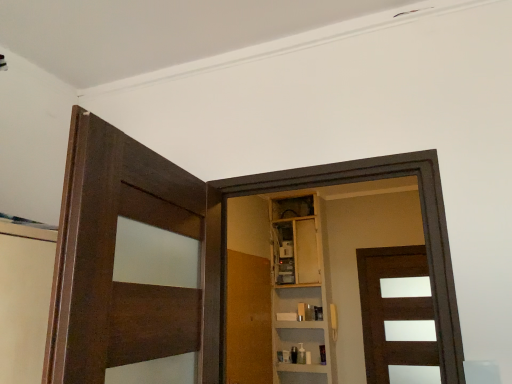
Question: Can you confirm if dark wood door at left, placed as the third door when sorted from right to left, is smaller than wooden door at center, the 2th door when ordered from front to back?

Choices:
 (A) yes
 (B) no

Answer: (A)

Question: Is dark wood door at left, placed as the third door when sorted from right to left, positioned far away from wooden door at center, the 2th door when ordered from front to back?

Choices:
 (A) no
 (B) yes

Answer: (B)

Question: From a real-world perspective, is dark wood door at left, the first door viewed from the left, positioned over wooden door at center, the 2th door when ordered from front to back, based on gravity?

Choices:
 (A) yes
 (B) no

Answer: (A)

Question: Can you confirm if dark wood door at left, which is the 3th door from back to front, is bigger than wooden door at center, which appears as the second door when viewed from the back?

Choices:
 (A) yes
 (B) no

Answer: (B)

Question: Is dark wood door at left, placed as the third door when sorted from right to left, facing away from wooden door at center, the 2th door when ordered from front to back?

Choices:
 (A) no
 (B) yes

Answer: (A)

Question: Is dark wood door at left, the first door viewed from the left, closer to the viewer compared to wooden door at center, marked as the 2th door in a left-to-right arrangement?

Choices:
 (A) yes
 (B) no

Answer: (A)

Question: Is wooden cabinet at center facing towards dark wood door at left, which is the 3th door from back to front?

Choices:
 (A) no
 (B) yes

Answer: (B)

Question: Is wooden cabinet at center further to camera compared to dark wood door at left, the first door viewed from the left?

Choices:
 (A) no
 (B) yes

Answer: (B)

Question: Is wooden cabinet at center outside dark wood door at left, placed as the third door when sorted from right to left?

Choices:
 (A) no
 (B) yes

Answer: (B)

Question: From a real-world perspective, does wooden cabinet at center stand above dark wood door at left, placed as the third door when sorted from right to left?

Choices:
 (A) yes
 (B) no

Answer: (A)

Question: Can you confirm if wooden cabinet at center is taller than dark wood door at left, placed as the third door when sorted from right to left?

Choices:
 (A) yes
 (B) no

Answer: (A)

Question: Is wooden cabinet at center positioned in front of dark wood door at left, placed as the third door when sorted from right to left?

Choices:
 (A) yes
 (B) no

Answer: (B)

Question: Is dark wood door at left, the first door viewed from the left, touching brown matte door at center, acting as the third door starting from the front?

Choices:
 (A) yes
 (B) no

Answer: (B)